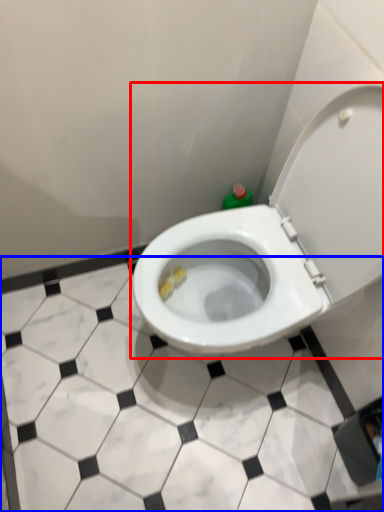
Question: Which point is further to the camera, toilet (highlighted by a red box) or tile (highlighted by a blue box)?

Choices:
 (A) toilet
 (B) tile

Answer: (B)